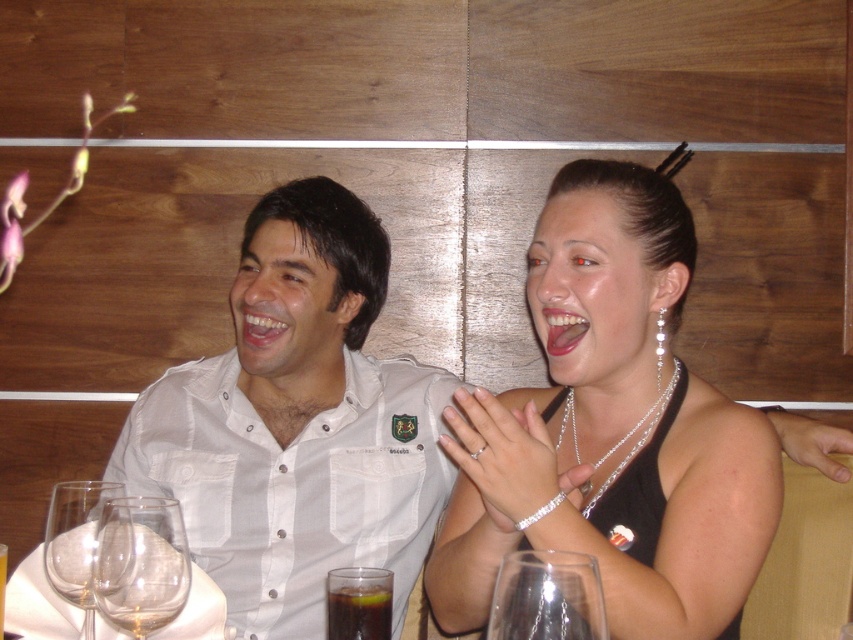
Question: Can you confirm if white cotton shirt at center is thinner than transparent glass at lower center?

Choices:
 (A) no
 (B) yes

Answer: (A)

Question: Considering the real-world distances, which object is closest to the silver metallic necklace at upper center?

Choices:
 (A) transparent glass at lower center
 (B) satin black dress at center
 (C) dark brown liquid at lower center

Answer: (B)

Question: Is the position of white cotton shirt at center less distant than that of transparent glass at lower center?

Choices:
 (A) yes
 (B) no

Answer: (B)

Question: Among these objects, which one is nearest to the camera?

Choices:
 (A) clear glass wine glass at lower left
 (B) satin black dress at center
 (C) dark brown liquid at lower center
 (D) transparent glass at lower center

Answer: (D)

Question: Is dark brown liquid at lower center to the left of silver metallic necklace at upper center from the viewer's perspective?

Choices:
 (A) yes
 (B) no

Answer: (A)

Question: Considering the real-world distances, which object is farthest from the dark brown liquid at lower center?

Choices:
 (A) silver metallic necklace at upper center
 (B) white cotton shirt at center

Answer: (B)